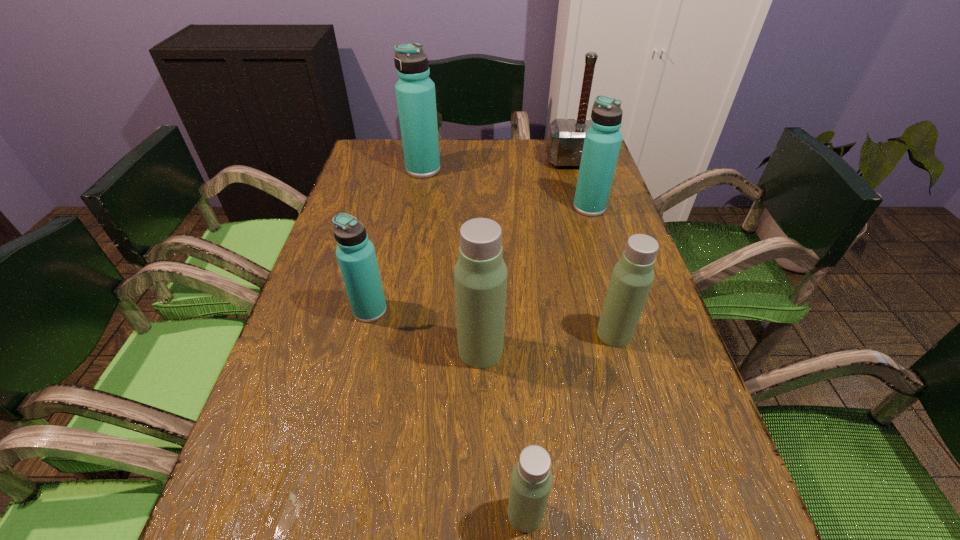
Where is `vacant area that lies between the farthest aqua thermos bottle and the second farthest thermos bottle`? The image size is (960, 540). vacant area that lies between the farthest aqua thermos bottle and the second farthest thermos bottle is located at coordinates (506, 188).

Identify which object is the closest to the shortest thermos bottle. Please provide its 2D coordinates. Your answer should be formatted as a tuple, i.e. [(x, y)], where the tuple contains the x and y coordinates of a point satisfying the conditions above.

[(480, 275)]

At what (x,y) coordinates should I click in order to perform the action: click on object that is the closest to the brown hammer. Please return your answer as a coordinate pair (x, y). The height and width of the screenshot is (540, 960). Looking at the image, I should click on (602, 142).

At what (x,y) coordinates should I click in order to perform the action: click on thermos bottle that can be found as the closest to the farthest aqua thermos bottle. Please return your answer as a coordinate pair (x, y). This screenshot has height=540, width=960. Looking at the image, I should click on (602, 142).

Locate an element on the screen. thermos bottle that is the fifth nearest to the biggest light thermos bottle is located at coordinates (415, 91).

Where is `aqua thermos bottle that can be found as the third closest to the brown hammer`? aqua thermos bottle that can be found as the third closest to the brown hammer is located at coordinates tap(355, 253).

This screenshot has height=540, width=960. I want to click on the closest aqua thermos bottle relative to the rightmost aqua thermos bottle, so click(415, 91).

Locate an element on the screen. light thermos bottle identified as the closest to the hammer is located at coordinates (633, 275).

Image resolution: width=960 pixels, height=540 pixels. In order to click on light thermos bottle that is the closest to the rightmost light thermos bottle in this screenshot , I will do `click(480, 275)`.

Locate an element on the screen. This screenshot has height=540, width=960. vacant space that satisfies the following two spatial constraints: 1. on the back side of the nearest aqua thermos bottle; 2. on the left side of the tallest thermos bottle is located at coordinates (404, 170).